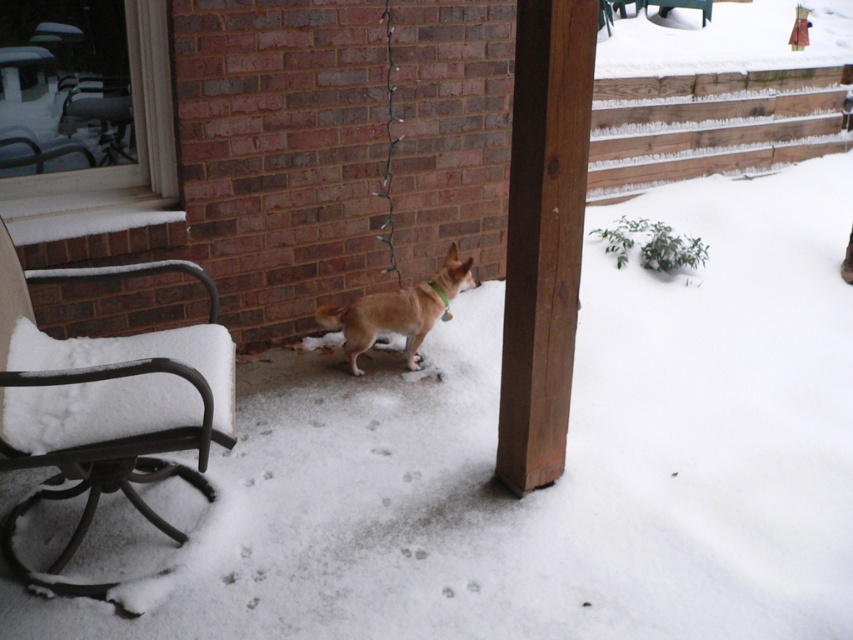
Is point (207, 348) behind point (402, 301)?

No, (207, 348) is in front of (402, 301).

Does metallic black chair at left come behind brown furry dog at center?

No, it is in front of brown furry dog at center.

This screenshot has height=640, width=853. What do you see at coordinates (105, 403) in the screenshot? I see `metallic black chair at left` at bounding box center [105, 403].

Locate an element on the screen. The height and width of the screenshot is (640, 853). metallic black chair at left is located at coordinates (105, 403).